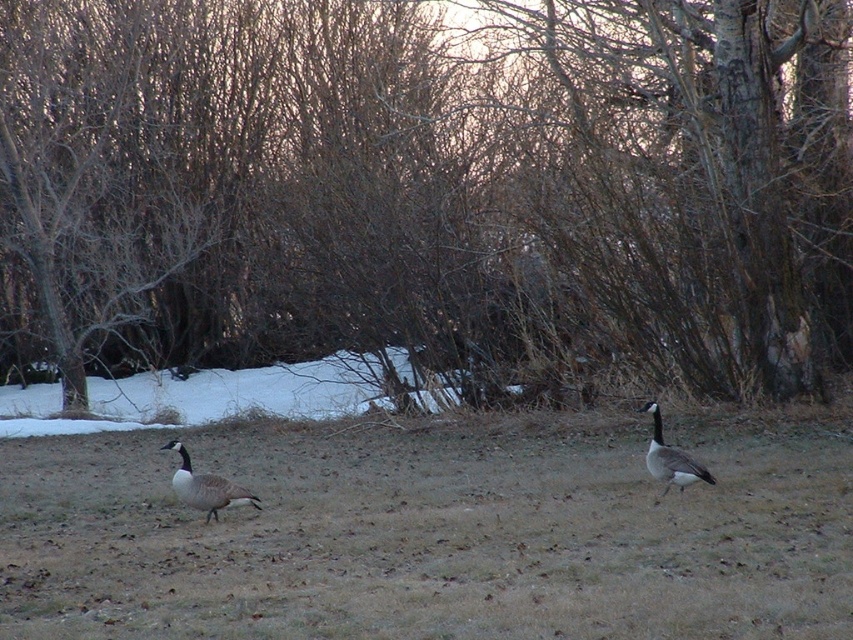
You are a bird flying over a winter scene and want to land on one of the two points marked in the image. The first point is at coordinates point (94,387) and the second is at point (704,474). Which point is closer to the dense collection of bare trees in the background?

Point (94,387) is behind point (704,474), so it is closer to the dense collection of bare trees in the background.

You are a photographer trying to capture both the brown dry grass at center and the gray matte goose at lower left in the same frame. Based on their positions, which object is closer to the camera?

The brown dry grass at center is positioned over the gray matte goose at lower left, meaning it is closer to the camera.